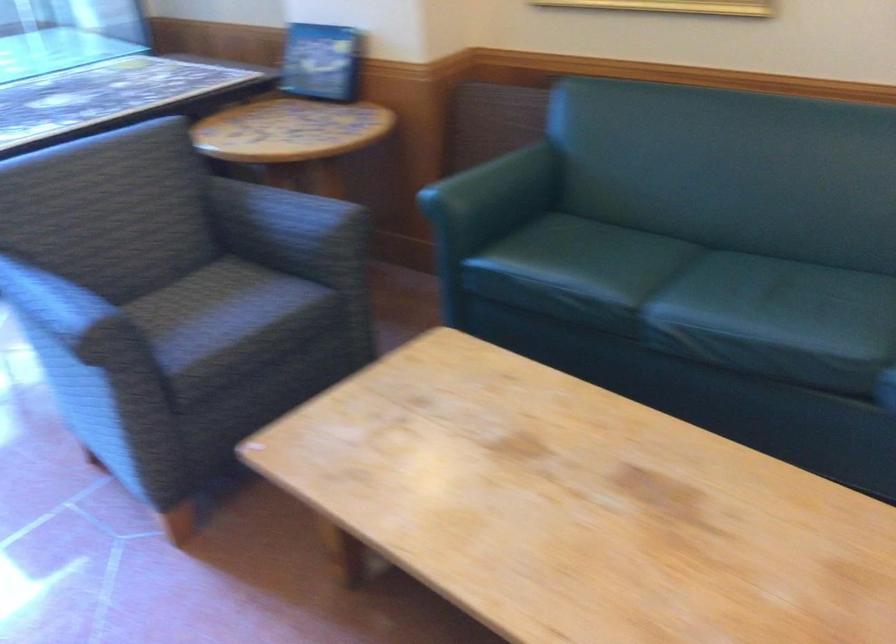
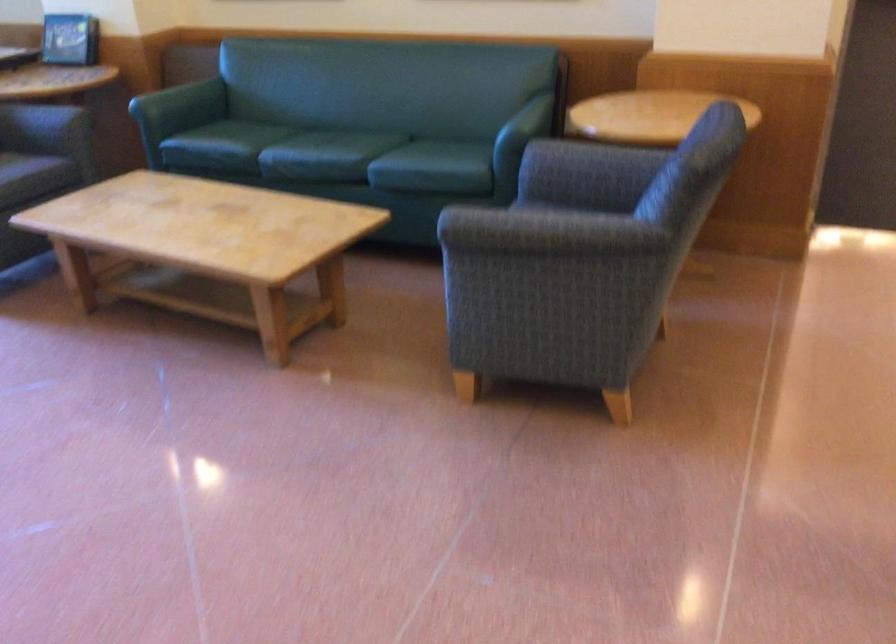
Question: What movement of the cameraman would produce the second image?

Choices:
 (A) Left
 (B) Right
 (C) Forward
 (D) Backward

Answer: (D)